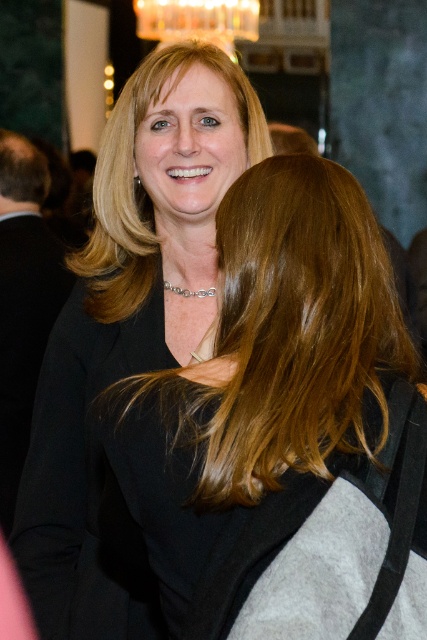
You are a photographer at this event. You want to take a photo of the blonde hair at center and the blonde smooth hair at upper center. Which one should you focus on first to ensure both are in clear focus?

You should focus on the blonde hair at center first since it is closer to the viewer than the blonde smooth hair at upper center. By focusing on the closer object, the farther one will also be in focus due to the depth of field.